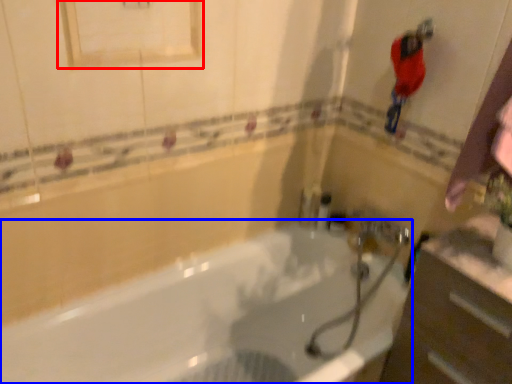
Question: Which object is further to the camera taking this photo, medicine cabinet (highlighted by a red box) or bathtub (highlighted by a blue box)?

Choices:
 (A) medicine cabinet
 (B) bathtub

Answer: (A)